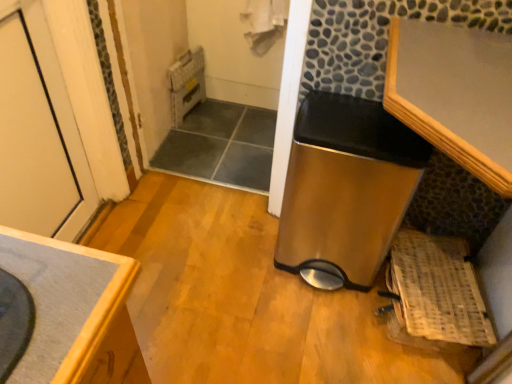
Identify the location of vacant area that is situated to the right of metallic gray water heater at upper center, which is counted as the 2th water heater, starting from the front. (212, 113).